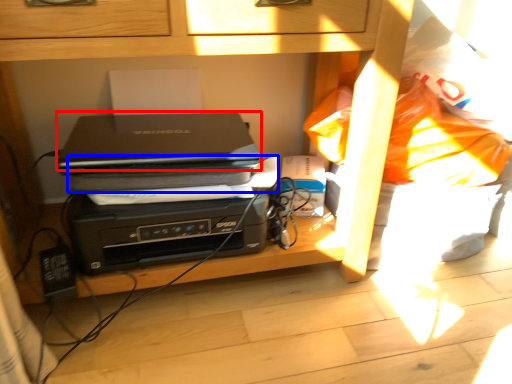
Question: Which point is closer to the camera, laptop (highlighted by a red box) or paperback book (highlighted by a blue box)?

Choices:
 (A) laptop
 (B) paperback book

Answer: (A)